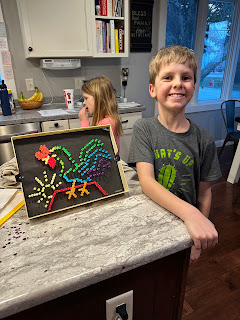
Where is `chairchair`? The height and width of the screenshot is (320, 240). chairchair is located at coordinates (231, 114), (237, 190).